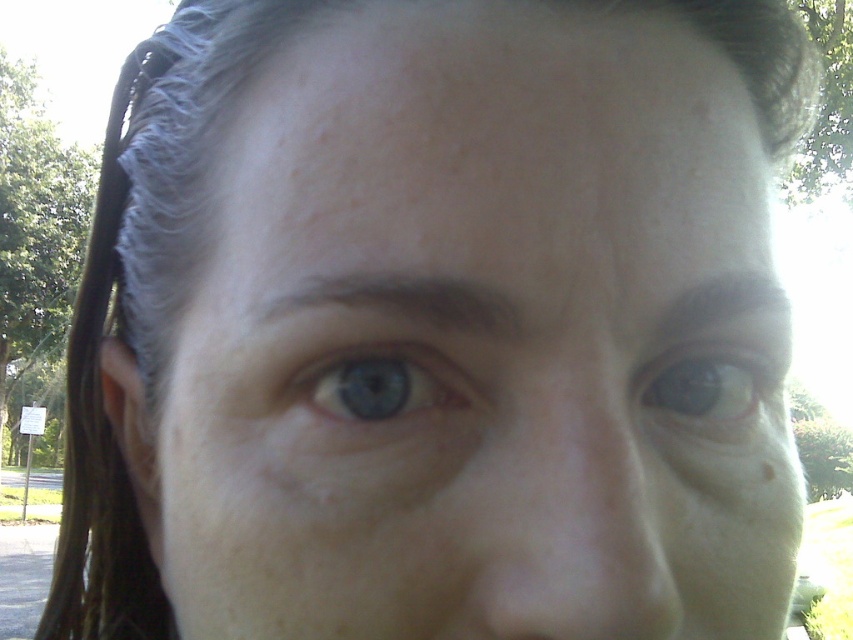
Is blue matte eye at upper center smaller than blue matte eye at center?

Actually, blue matte eye at upper center might be larger than blue matte eye at center.

The width and height of the screenshot is (853, 640). What do you see at coordinates (711, 392) in the screenshot?
I see `blue matte eye at upper center` at bounding box center [711, 392].

The width and height of the screenshot is (853, 640). I want to click on blue matte eye at upper center, so [711, 392].

Does point (527, 262) come behind point (347, 404)?

No, it is in front of (347, 404).

Who is higher up, smooth skin face at center or blue matte eye at center?

blue matte eye at center is above.

Is point (314, 65) more distant than point (300, 374)?

Yes, point (314, 65) is behind point (300, 374).

You are a GUI agent. You are given a task and a screenshot of the screen. Output one action in this format:
    pyautogui.click(x=<x>, y=<y>)
    Task: Click on the smooth skin face at center
    This screenshot has width=853, height=640.
    Given the screenshot: What is the action you would take?
    pyautogui.click(x=474, y=339)

Is smooth skin face at center to the left of blue matte eye at upper center from the viewer's perspective?

Indeed, smooth skin face at center is positioned on the left side of blue matte eye at upper center.

The width and height of the screenshot is (853, 640). Describe the element at coordinates (474, 339) in the screenshot. I see `smooth skin face at center` at that location.

Who is more distant from viewer, (x=576, y=131) or (x=711, y=371)?

The point (x=711, y=371) is behind.

Locate an element on the screen. The image size is (853, 640). smooth skin face at center is located at coordinates (474, 339).